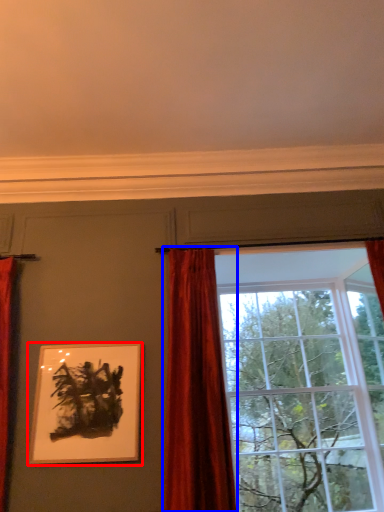
Question: Which point is further to the camera, picture frame (highlighted by a red box) or curtain (highlighted by a blue box)?

Choices:
 (A) picture frame
 (B) curtain

Answer: (A)